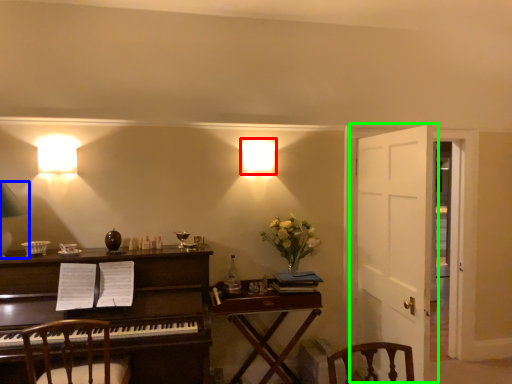
Question: Based on their relative distances, which object is nearer to lamp (highlighted by a red box)? Choose from lamp (highlighted by a blue box) and door (highlighted by a green box).

Choices:
 (A) lamp
 (B) door

Answer: (B)